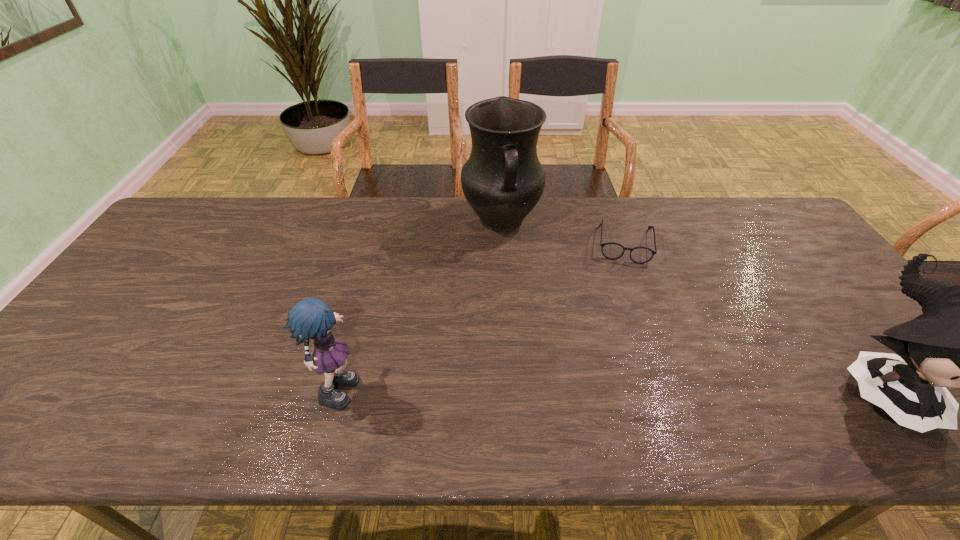
This screenshot has width=960, height=540. Identify the location of vacant space at the far right corner. (761, 225).

Identify the location of free space between the tallest object and the spectacles. The height and width of the screenshot is (540, 960). (563, 232).

Where is `free space that is in between the shortest object and the rag doll`? free space that is in between the shortest object and the rag doll is located at coordinates coord(483,313).

Locate an element on the screen. The width and height of the screenshot is (960, 540). the closest object to the rag doll is located at coordinates (503, 179).

Locate which object ranks second in proximity to the shortest object. Please provide its 2D coordinates. Your answer should be formatted as a tuple, i.e. [(x, y)], where the tuple contains the x and y coordinates of a point satisfying the conditions above.

[(959, 341)]

In order to click on blank area in the image that satisfies the following two spatial constraints: 1. on the front side of the tallest object; 2. on the right side of the spectacles in this screenshot , I will do `click(503, 243)`.